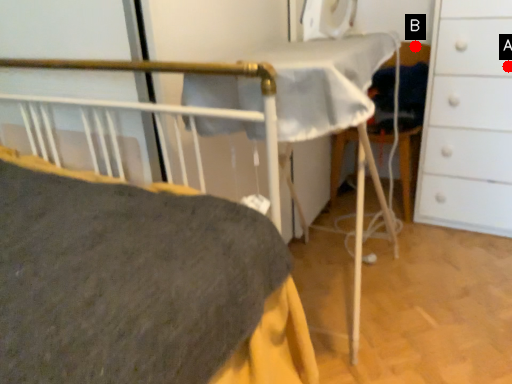
Question: Two points are circled on the image, labeled by A and B beside each circle. Which point is farther from the camera taking this photo?

Choices:
 (A) A is further
 (B) B is further

Answer: (B)